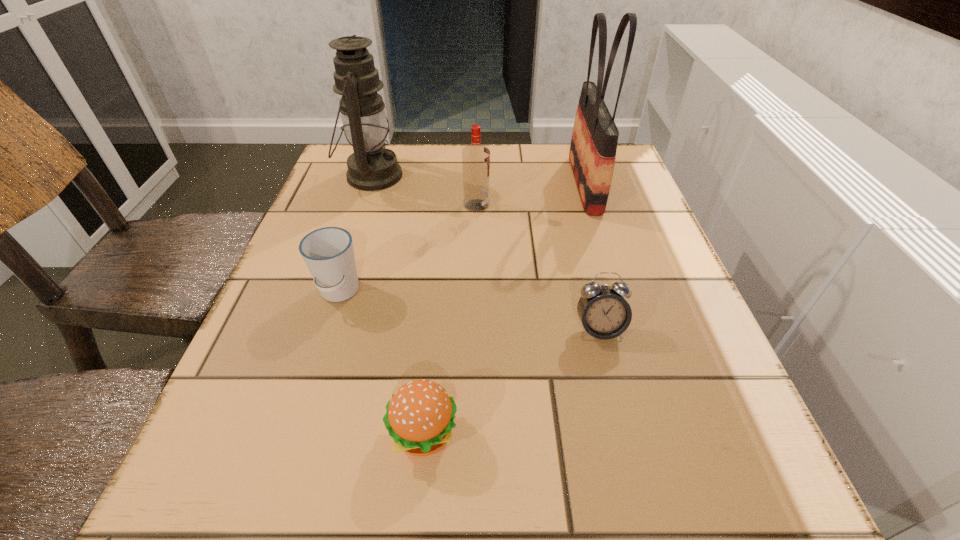
Where is `shopping bag`? shopping bag is located at coordinates (593, 147).

Identify the location of oil lamp. (372, 167).

Identify the location of vodka. (475, 157).

Find the location of `the fourth farthest object`. the fourth farthest object is located at coordinates (328, 253).

The height and width of the screenshot is (540, 960). Identify the location of alarm clock. pyautogui.click(x=603, y=311).

The height and width of the screenshot is (540, 960). In order to click on the nearest object in this screenshot , I will do `click(419, 417)`.

Find the location of `hamburger`. hamburger is located at coordinates (419, 417).

Where is `free space located 0.180m on the front-facing side of the shopping bag`? free space located 0.180m on the front-facing side of the shopping bag is located at coordinates (496, 184).

Find the location of a particular element. The image size is (960, 540). vacant region located 0.250m on the front-facing side of the shopping bag is located at coordinates (468, 184).

Identify the location of vacant space positioned 0.190m on the front-facing side of the shopping bag. The width and height of the screenshot is (960, 540). (492, 184).